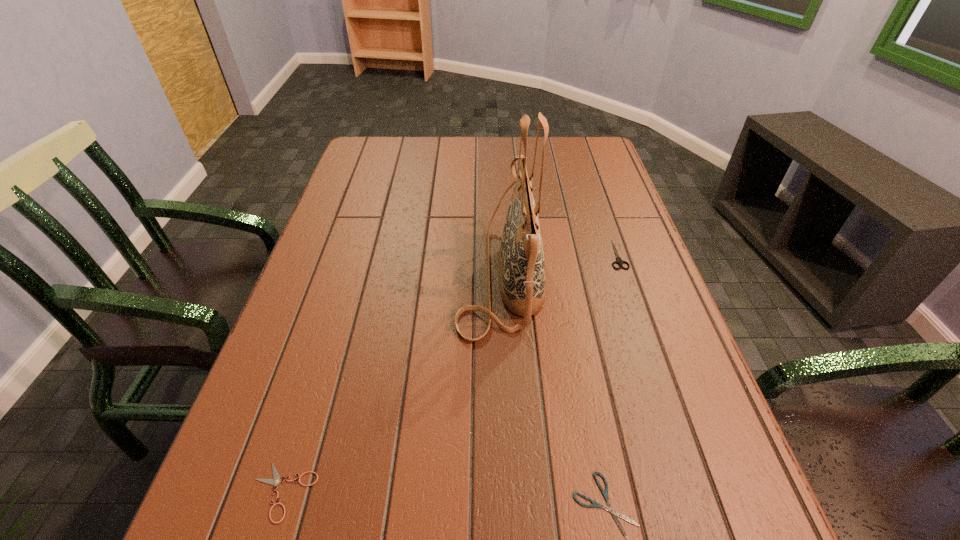
Point out which object is positioned as the third nearest to the handbag. Please provide its 2D coordinates. Your answer should be formatted as a tuple, i.e. [(x, y)], where the tuple contains the x and y coordinates of a point satisfying the conditions above.

[(276, 481)]

Point out which object is positioned as the second nearest to the handbag. Please provide its 2D coordinates. Your answer should be formatted as a tuple, i.e. [(x, y)], where the tuple contains the x and y coordinates of a point satisfying the conditions above.

[(614, 513)]

Identify the location of shears that is the second closest one to the second shears from left to right. The width and height of the screenshot is (960, 540). (619, 261).

Find the location of a particular element. the third closest shears to the handbag is located at coordinates (276, 481).

Where is `vacant space that satisfies the following two spatial constraints: 1. on the back side of the leftmost shears; 2. on the right side of the farthest shears`? The height and width of the screenshot is (540, 960). vacant space that satisfies the following two spatial constraints: 1. on the back side of the leftmost shears; 2. on the right side of the farthest shears is located at coordinates (x=356, y=254).

At what (x,y) coordinates should I click in order to perform the action: click on free space that satisfies the following two spatial constraints: 1. on the front-facing side of the tallest object; 2. on the front side of the leftmost object. Please return your answer as a coordinate pair (x, y). The width and height of the screenshot is (960, 540). Looking at the image, I should click on (511, 491).